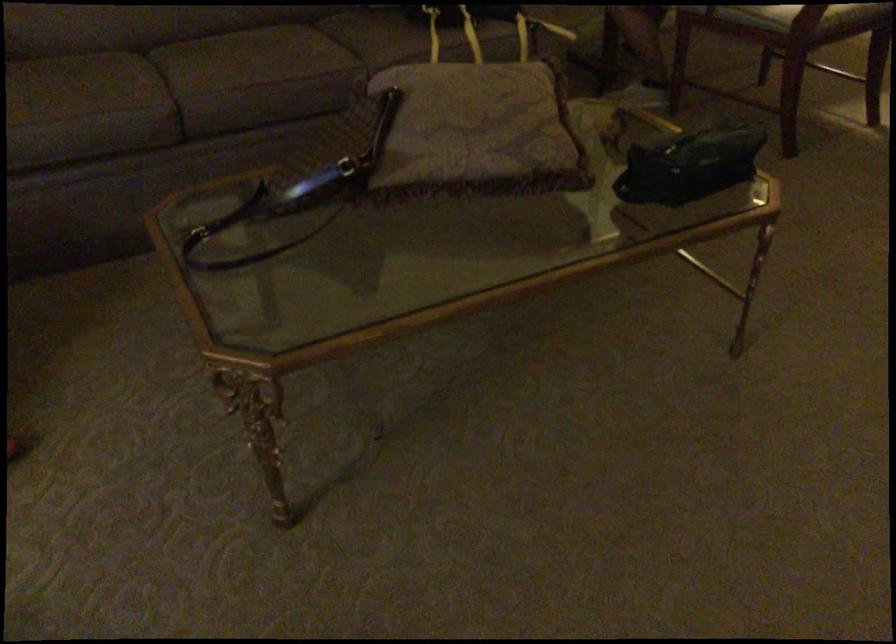
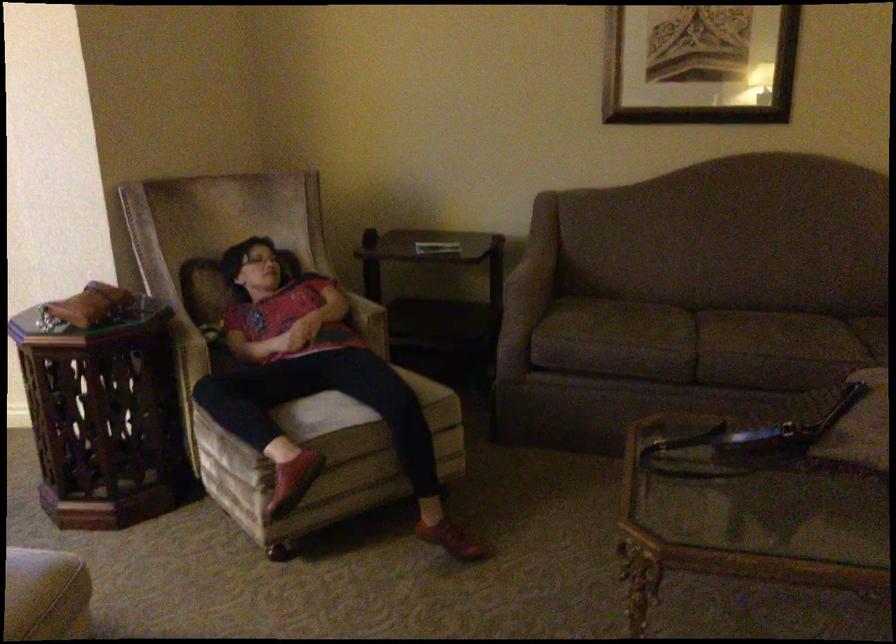
The point at [176,106] is marked in the first image. Where is the corresponding point in the second image?

(695, 345)